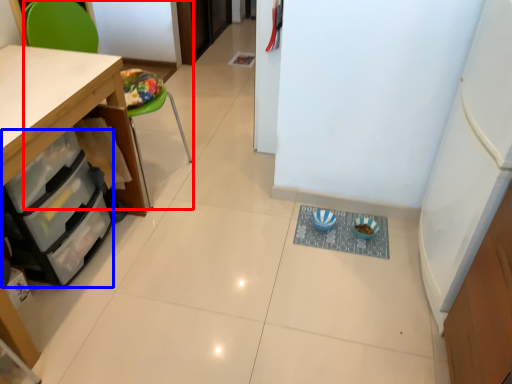
Question: Among these objects, which one is nearest to the camera, chair (highlighted by a red box) or drawer (highlighted by a blue box)?

Choices:
 (A) chair
 (B) drawer

Answer: (B)